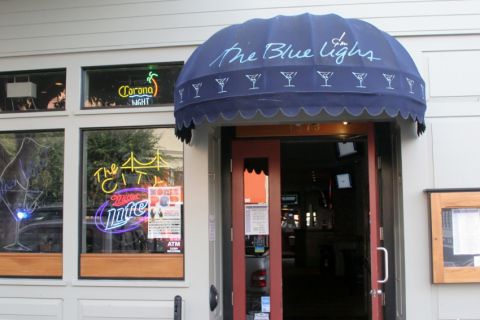
You are a GUI agent. You are given a task and a screenshot of the screen. Output one action in this format:
    pyautogui.click(x=<x>, y=<y>)
    Task: Click on the bar
    This screenshot has width=480, height=320.
    Given the screenshot: What is the action you would take?
    pyautogui.click(x=132, y=104)